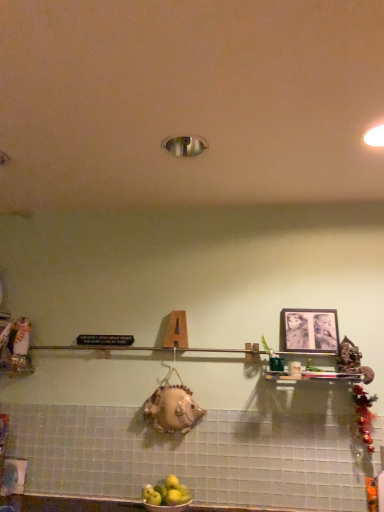
Question: From the image's perspective, relative to black matte picture frame at upper right, is yellow matte apples at lower center above or below?

Choices:
 (A) below
 (B) above

Answer: (A)

Question: Considering the positions of yellow matte apples at lower center and black matte picture frame at upper right in the image, is yellow matte apples at lower center wider or thinner than black matte picture frame at upper right?

Choices:
 (A) thin
 (B) wide

Answer: (B)

Question: In the image, is yellow matte apples at lower center on the left side or the right side of black matte picture frame at upper right?

Choices:
 (A) left
 (B) right

Answer: (A)

Question: Is black matte picture frame at upper right taller or shorter than yellow matte apples at lower center?

Choices:
 (A) tall
 (B) short

Answer: (A)

Question: Is point (307, 314) closer or farther from the camera than point (160, 484)?

Choices:
 (A) farther
 (B) closer

Answer: (A)

Question: Is black matte picture frame at upper right situated inside yellow matte apples at lower center or outside?

Choices:
 (A) inside
 (B) outside

Answer: (B)

Question: From a real-world perspective, is black matte picture frame at upper right above or below yellow matte apples at lower center?

Choices:
 (A) above
 (B) below

Answer: (A)